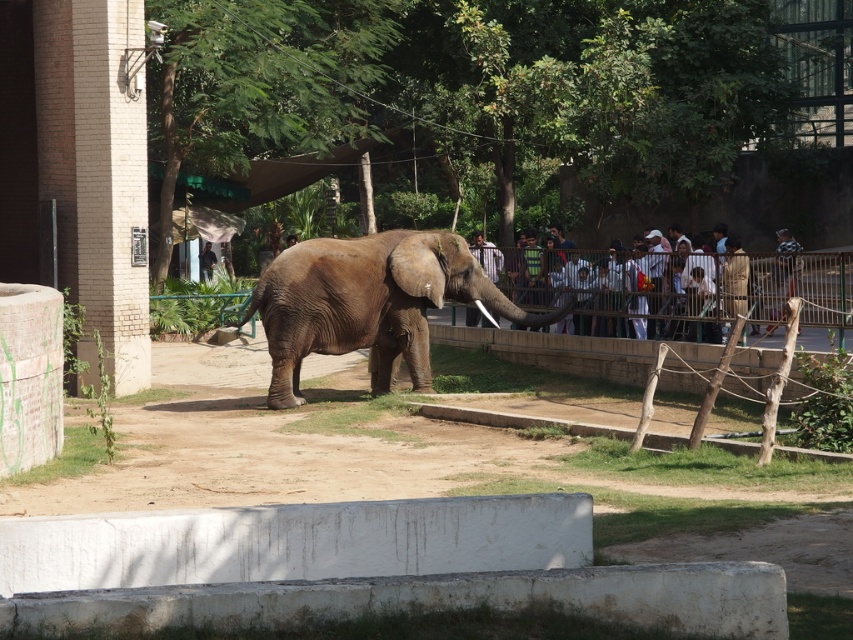
Is brown textured elephant at center to the left of dark brown leather jacket at center from the viewer's perspective?

No, brown textured elephant at center is not to the left of dark brown leather jacket at center.

Who is shorter, brown textured elephant at center or dark brown leather jacket at center?

dark brown leather jacket at center is shorter.

This screenshot has width=853, height=640. Describe the element at coordinates (368, 304) in the screenshot. I see `brown textured elephant at center` at that location.

Identify the location of brown textured elephant at center. (368, 304).

Based on the photo, is brown textured elephant at center behind light brown fabric shirt at center?

Yes, brown textured elephant at center is further from the viewer.

Does brown textured elephant at center appear under light brown fabric shirt at center?

Indeed, brown textured elephant at center is positioned under light brown fabric shirt at center.

At what (x,y) coordinates should I click in order to perform the action: click on brown textured elephant at center. Please return your answer as a coordinate pair (x, y). This screenshot has width=853, height=640. Looking at the image, I should click on (368, 304).

Between light brown fabric shirt at center and dark brown leather jacket at center, which one is positioned higher?

dark brown leather jacket at center

Can you confirm if light brown fabric shirt at center is positioned above dark brown leather jacket at center?

No, light brown fabric shirt at center is not above dark brown leather jacket at center.

Find the location of a particular element. light brown fabric shirt at center is located at coordinates (653, 285).